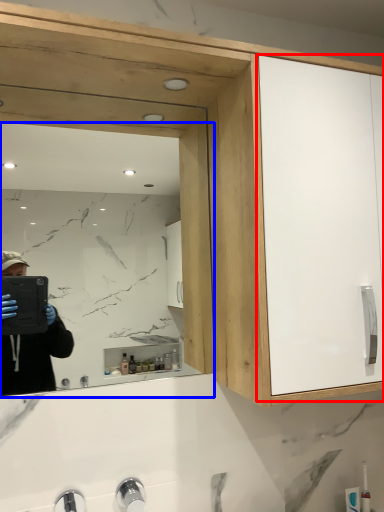
Question: Which of the following is the closest to the observer, glass door (highlighted by a red box) or mirror (highlighted by a blue box)?

Choices:
 (A) glass door
 (B) mirror

Answer: (A)